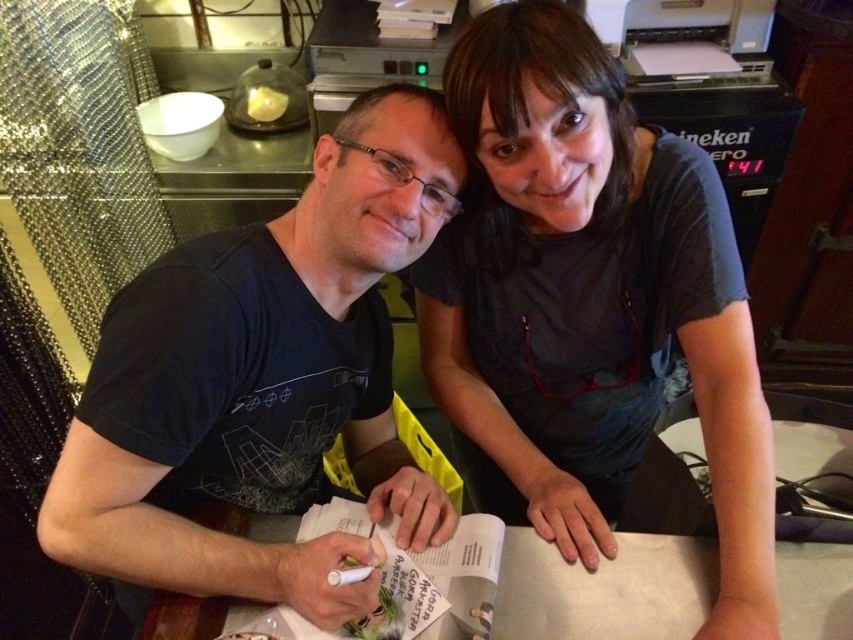
Question: Does black matte t-shirt at left have a smaller size compared to white paper at center?

Choices:
 (A) yes
 (B) no

Answer: (B)

Question: Can you confirm if dark gray shirt at upper center is thinner than black matte t-shirt at left?

Choices:
 (A) no
 (B) yes

Answer: (B)

Question: Which point is farther from the camera taking this photo?

Choices:
 (A) (297, 300)
 (B) (759, 422)

Answer: (A)

Question: Which object is farther from the camera taking this photo?

Choices:
 (A) black matte t-shirt at left
 (B) dark gray shirt at upper center

Answer: (B)

Question: Is black matte t-shirt at left to the left of white paper at center from the viewer's perspective?

Choices:
 (A) no
 (B) yes

Answer: (B)

Question: Which object is farther from the camera taking this photo?

Choices:
 (A) white paper at center
 (B) dark gray shirt at upper center

Answer: (A)